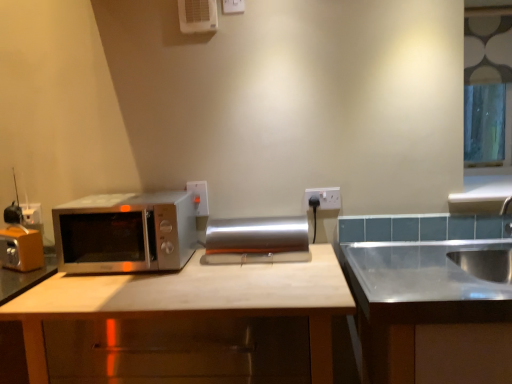
At what (x,y) coordinates should I click in order to perform the action: click on vacant area in front of satin silver microwave at left. Please return your answer as a coordinate pair (x, y). Image resolution: width=512 pixels, height=384 pixels. Looking at the image, I should click on (117, 289).